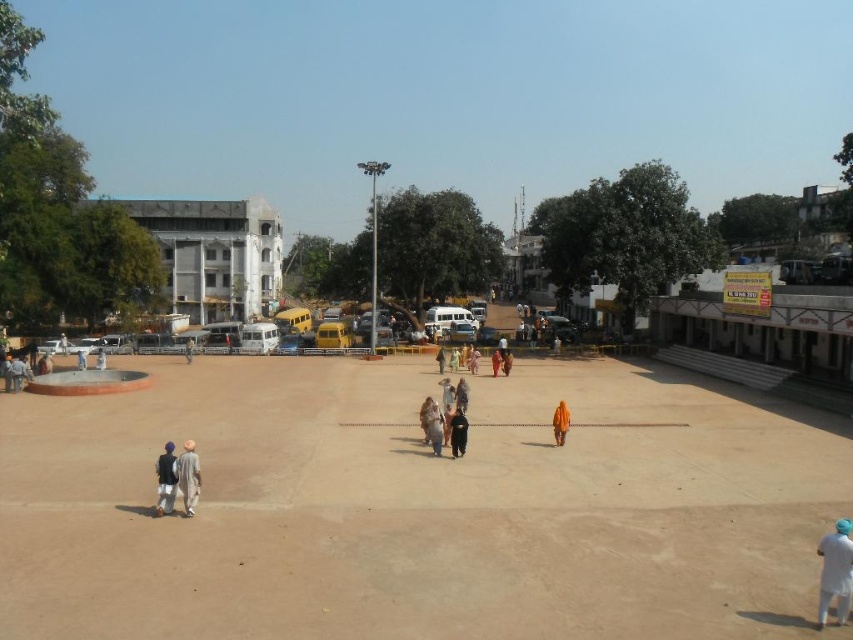
Question: Can you confirm if brown sand at center is positioned to the right of light brown cotton kurta at lower left?

Choices:
 (A) yes
 (B) no

Answer: (A)

Question: Observing the image, what is the correct spatial positioning of brown sand at center in reference to light brown cotton kurta at lower left?

Choices:
 (A) left
 (B) right

Answer: (B)

Question: Estimate the real-world distances between objects in this image. Which object is farther from the white cotton shirt at lower right?

Choices:
 (A) light brown wooden bench at center
 (B) dark brown leather bag at center
 (C) light brown cotton kurta at lower left

Answer: (A)

Question: Among these points, which one is nearest to the camera?

Choices:
 (A) (488, 554)
 (B) (842, 552)
 (C) (461, 449)

Answer: (B)

Question: In this image, where is brown sand at center located relative to brown leather elephant at center?

Choices:
 (A) left
 (B) right

Answer: (A)

Question: Which point is farther from the camera taking this photo?

Choices:
 (A) (451, 454)
 (B) (181, 481)
 (C) (15, 548)

Answer: (A)